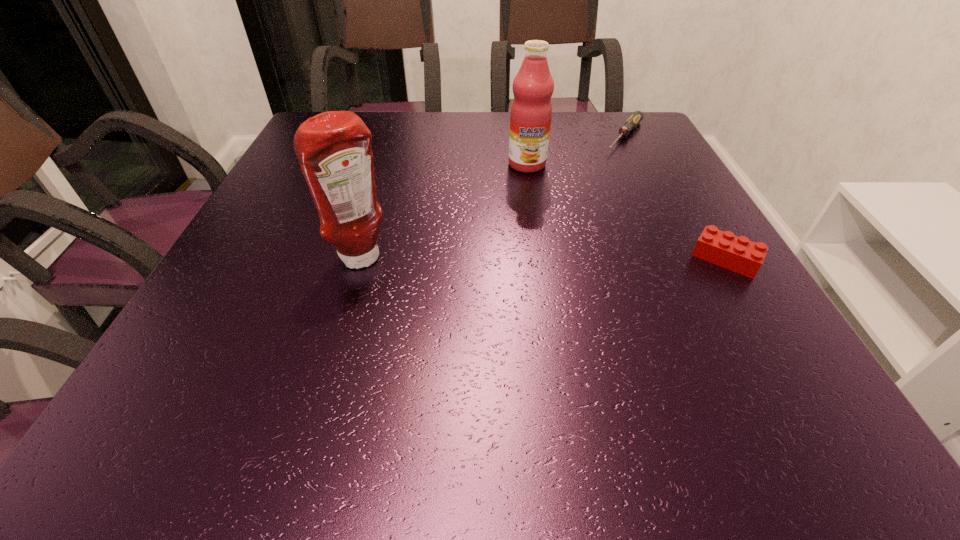
Locate an element on the screen. The height and width of the screenshot is (540, 960). vacant space on the desktop that is between the condiment and the second shortest object and is positioned on the label of the second farthest object is located at coordinates (531, 259).

I want to click on free space on the desktop that is between the leftmost object and the third tallest object and is positioned insert the screwdriver into a screw head, so click(518, 259).